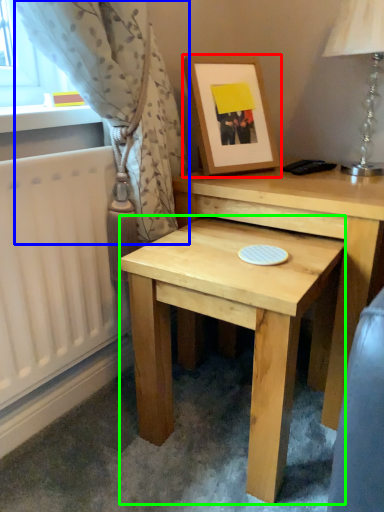
Question: Estimate the real-world distances between objects in this image. Which object is closer to picture frame (highlighted by a red box), curtain (highlighted by a blue box) or table (highlighted by a green box)?

Choices:
 (A) curtain
 (B) table

Answer: (A)